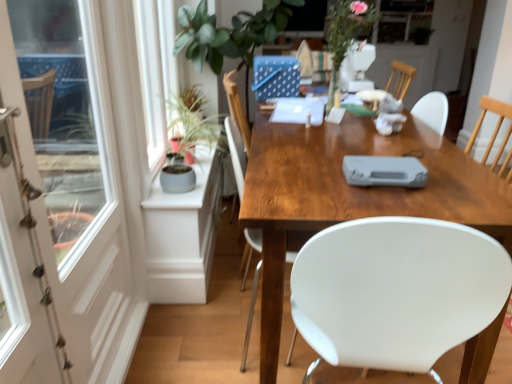
Question: Can you confirm if wooden desk at center is bigger than metallic silver screen door at left, placed as the 2th screen door when sorted from left to right?

Choices:
 (A) no
 (B) yes

Answer: (B)

Question: Is wooden desk at center thinner than metallic silver screen door at left, placed as the 2th screen door when sorted from left to right?

Choices:
 (A) yes
 (B) no

Answer: (B)

Question: Is wooden desk at center taller than metallic silver screen door at left, placed as the 2th screen door when sorted from left to right?

Choices:
 (A) no
 (B) yes

Answer: (B)

Question: Can metallic silver screen door at left, placed as the 2th screen door when sorted from left to right, be found inside wooden desk at center?

Choices:
 (A) no
 (B) yes

Answer: (A)

Question: Are wooden desk at center and metallic silver screen door at left, placed as the 2th screen door when sorted from left to right, making contact?

Choices:
 (A) no
 (B) yes

Answer: (A)

Question: Is white plastic game console at center in front of or behind wooden desk at center in the image?

Choices:
 (A) front
 (B) behind

Answer: (B)

Question: Considering the positions of white plastic game console at center and wooden desk at center in the image, is white plastic game console at center bigger or smaller than wooden desk at center?

Choices:
 (A) small
 (B) big

Answer: (A)

Question: From a real-world perspective, relative to wooden desk at center, is white plastic game console at center vertically above or below?

Choices:
 (A) below
 (B) above

Answer: (B)

Question: Is white plastic game console at center wider or thinner than wooden desk at center?

Choices:
 (A) wide
 (B) thin

Answer: (B)

Question: Considering their positions, is floral arrangement at upper center located in front of or behind wooden desk at center?

Choices:
 (A) front
 (B) behind

Answer: (B)

Question: From a real-world perspective, is floral arrangement at upper center positioned above or below wooden desk at center?

Choices:
 (A) above
 (B) below

Answer: (A)

Question: Do you think floral arrangement at upper center is within wooden desk at center, or outside of it?

Choices:
 (A) inside
 (B) outside

Answer: (B)

Question: Looking at their shapes, would you say floral arrangement at upper center is wider or thinner than wooden desk at center?

Choices:
 (A) thin
 (B) wide

Answer: (A)

Question: Considering the positions of point (272, 135) and point (52, 355), is point (272, 135) closer or farther from the camera than point (52, 355)?

Choices:
 (A) closer
 (B) farther

Answer: (B)

Question: Relative to metallic silver screen door at left, which is the 1th screen door from right to left, is wooden desk at center in front or behind?

Choices:
 (A) behind
 (B) front

Answer: (A)